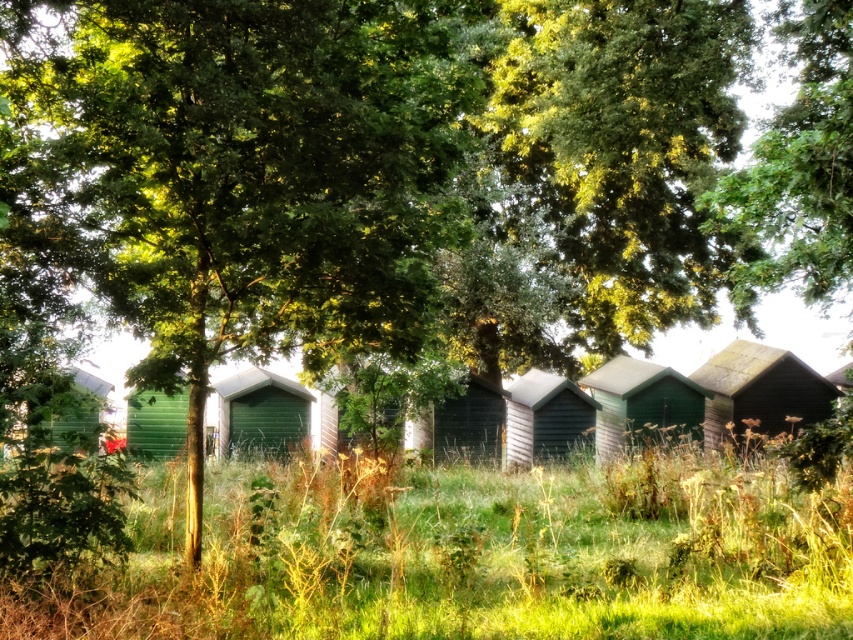
Question: Which point is farther from the camera taking this photo?

Choices:
 (A) (273, 442)
 (B) (498, 404)
 (C) (178, 333)

Answer: (B)

Question: Which point is farther from the camera taking this photo?

Choices:
 (A) (537, 536)
 (B) (775, 417)

Answer: (B)

Question: Does green grass at center appear on the left side of green wooden shed at center?

Choices:
 (A) no
 (B) yes

Answer: (B)

Question: Is green wood tree at center behind green wood beach hut at center?

Choices:
 (A) yes
 (B) no

Answer: (B)

Question: Does wooden shed at right have a smaller size compared to green wooden hut at lower left?

Choices:
 (A) no
 (B) yes

Answer: (B)

Question: Which object appears farthest from the camera in this image?

Choices:
 (A) green wooden shed at center
 (B) green wooden hut at lower left
 (C) dark green wooden hut at center

Answer: (C)